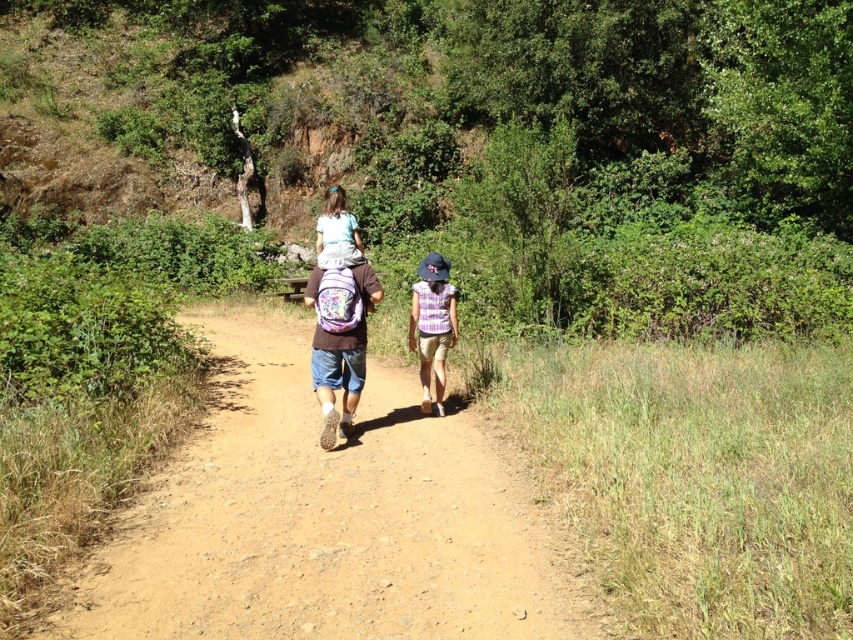
Who is positioned more to the left, brown dirt track at center or purple fabric backpack at center?

From the viewer's perspective, brown dirt track at center appears more on the left side.

Locate an element on the screen. Image resolution: width=853 pixels, height=640 pixels. brown dirt track at center is located at coordinates (323, 516).

Is point (450, 490) closer to viewer compared to point (343, 316)?

Yes, it is in front of point (343, 316).

Where is `brown dirt track at center`? The height and width of the screenshot is (640, 853). brown dirt track at center is located at coordinates (323, 516).

The height and width of the screenshot is (640, 853). Describe the element at coordinates (340, 340) in the screenshot. I see `purple fabric backpack at center` at that location.

Does purple fabric backpack at center have a greater width compared to purple striped shirt at center?

Yes, purple fabric backpack at center is wider than purple striped shirt at center.

Image resolution: width=853 pixels, height=640 pixels. In order to click on purple fabric backpack at center in this screenshot , I will do [x=340, y=340].

Does brown dirt track at center appear on the right side of purple striped shirt at center?

In fact, brown dirt track at center is to the left of purple striped shirt at center.

Does point (496, 468) lie in front of point (447, 346)?

Yes, it is.

You are a GUI agent. You are given a task and a screenshot of the screen. Output one action in this format:
    pyautogui.click(x=<x>, y=<y>)
    Task: Click on the brown dirt track at center
    The width and height of the screenshot is (853, 640).
    Given the screenshot: What is the action you would take?
    pyautogui.click(x=323, y=516)